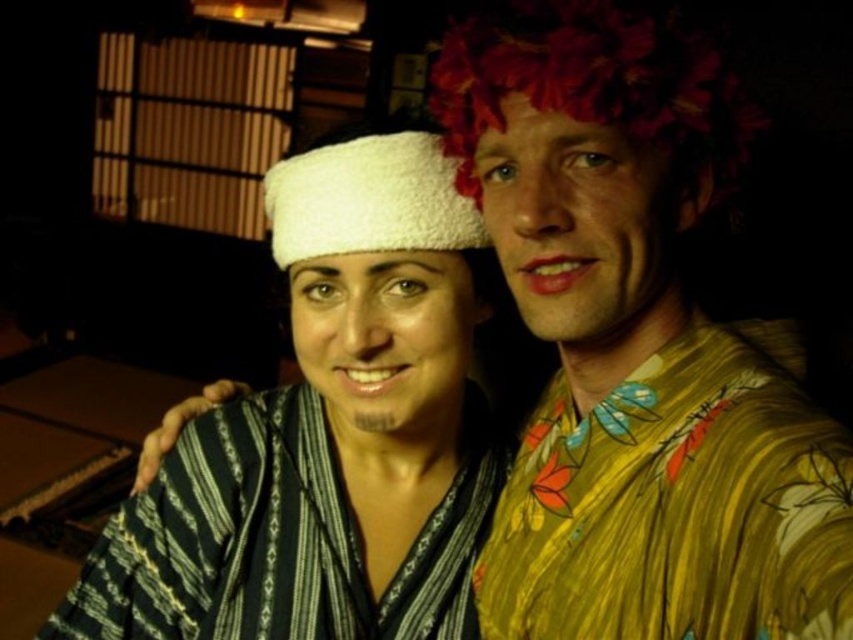
Measure the distance between floral-patterned shirt at upper right and camera.

18.74 inches

Does floral-patterned shirt at upper right appear on the right side of striped cotton robe at center?

Correct, you'll find floral-patterned shirt at upper right to the right of striped cotton robe at center.

This screenshot has height=640, width=853. What do you see at coordinates (636, 348) in the screenshot? I see `floral-patterned shirt at upper right` at bounding box center [636, 348].

You are a GUI agent. You are given a task and a screenshot of the screen. Output one action in this format:
    pyautogui.click(x=<x>, y=<y>)
    Task: Click on the floral-patterned shirt at upper right
    This screenshot has width=853, height=640.
    Given the screenshot: What is the action you would take?
    pyautogui.click(x=636, y=348)

In the scene shown: Which is more to the right, yellow floral robe at right or white fluffy bandage at center?

From the viewer's perspective, yellow floral robe at right appears more on the right side.

Is yellow floral robe at right above white fluffy bandage at center?

Actually, yellow floral robe at right is below white fluffy bandage at center.

Is point (810, 618) farther from camera compared to point (471, 234)?

No.

The width and height of the screenshot is (853, 640). Find the location of `yellow floral robe at right`. yellow floral robe at right is located at coordinates (677, 502).

Does point (628, 269) come farther from viewer compared to point (445, 216)?

No, it is in front of (445, 216).

Which is more to the left, floral fabric headband at upper right or white fluffy bandage at center?

white fluffy bandage at center is more to the left.

Between point (467, 161) and point (466, 428), which one is positioned in front?

Point (467, 161) is more forward.

Where is `floral fabric headband at upper right`? floral fabric headband at upper right is located at coordinates (599, 92).